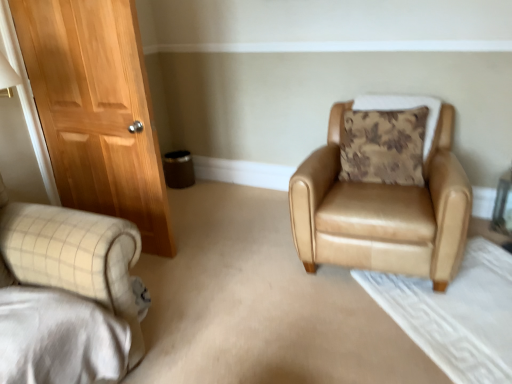
Question: Is brown floral cushion at upper right taller or shorter than tan leather armchair at center-right?

Choices:
 (A) short
 (B) tall

Answer: (A)

Question: Which is correct: brown floral cushion at upper right is inside tan leather armchair at center-right, or outside of it?

Choices:
 (A) inside
 (B) outside

Answer: (A)

Question: From the image's perspective, is brown floral cushion at upper right above or below tan leather armchair at center-right?

Choices:
 (A) above
 (B) below

Answer: (A)

Question: Considering the positions of tan leather armchair at center-right and brown floral cushion at upper right in the image, is tan leather armchair at center-right wider or thinner than brown floral cushion at upper right?

Choices:
 (A) wide
 (B) thin

Answer: (A)

Question: Do you think tan leather armchair at center-right is within brown floral cushion at upper right, or outside of it?

Choices:
 (A) inside
 (B) outside

Answer: (B)

Question: In terms of size, does tan leather armchair at center-right appear bigger or smaller than brown floral cushion at upper right?

Choices:
 (A) small
 (B) big

Answer: (B)

Question: Relative to brown floral cushion at upper right, is tan leather armchair at center-right in front or behind?

Choices:
 (A) front
 (B) behind

Answer: (A)